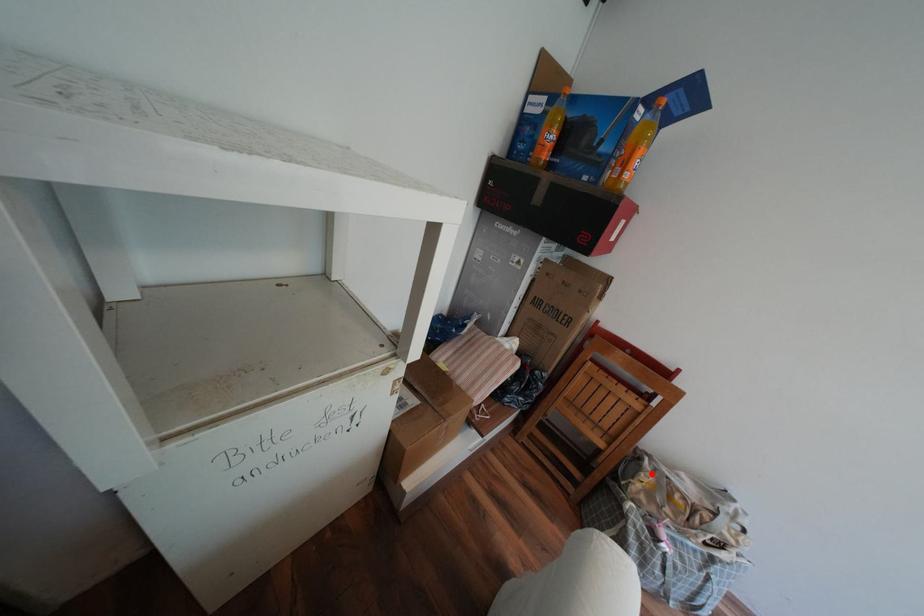
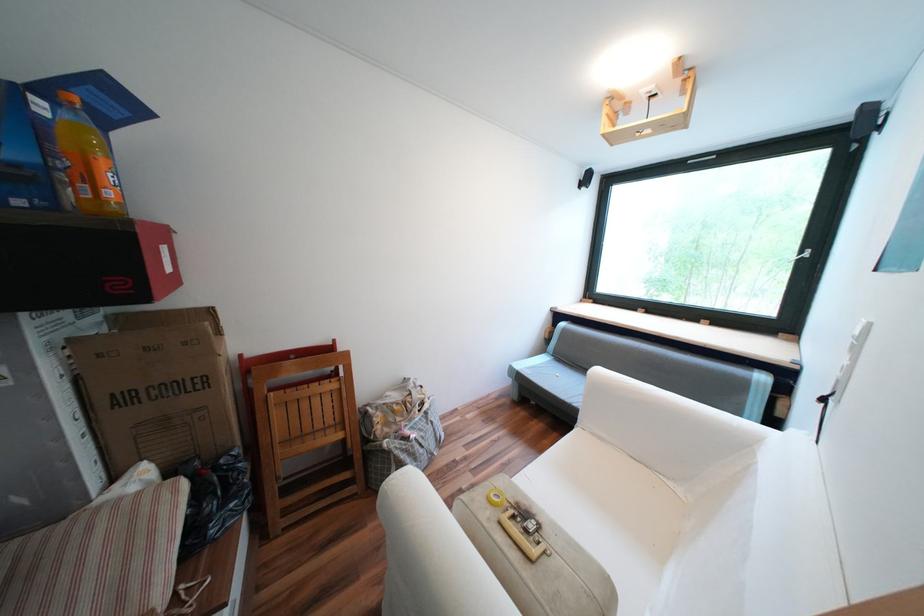
Question: I am providing you with two images of the same scene from different viewpoints. Image1 has a red point marked. In image2, the corresponding 3D location appears at what relative position? Reply with the corresponding letter.

Choices:
 (A) Closer
 (B) Farther

Answer: (B)